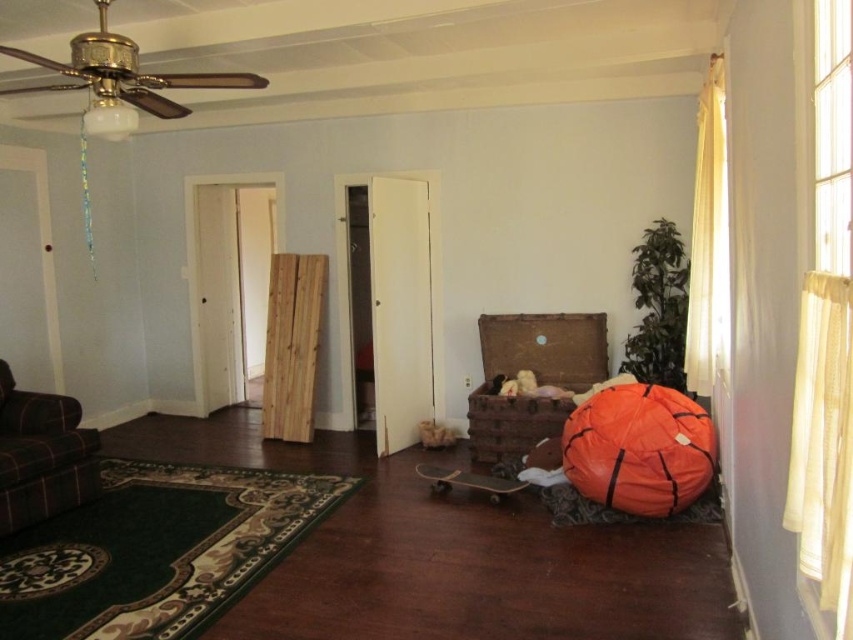
Question: Among these points, which one is farthest from the camera?

Choices:
 (A) (10, 381)
 (B) (572, 330)

Answer: (B)

Question: Is orange fabric sleeping bag at lower right above plaid fabric couch at lower left?

Choices:
 (A) yes
 (B) no

Answer: (A)

Question: Does orange fabric sleeping bag at lower right have a smaller size compared to rustic wooden trunk at center?

Choices:
 (A) yes
 (B) no

Answer: (A)

Question: Is rustic wooden trunk at center smaller than plaid fabric couch at lower left?

Choices:
 (A) no
 (B) yes

Answer: (A)

Question: Which point is farther to the camera?

Choices:
 (A) (555, 413)
 (B) (68, 396)
 (C) (596, 416)

Answer: (B)

Question: Which point is farther from the camera taking this photo?

Choices:
 (A) (42, 508)
 (B) (502, 401)
 (C) (590, 492)

Answer: (B)